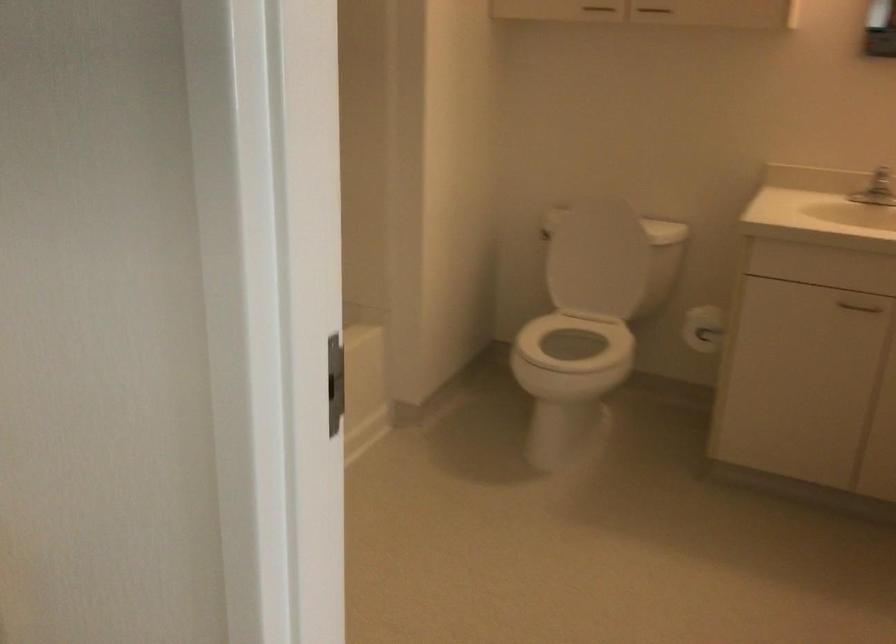
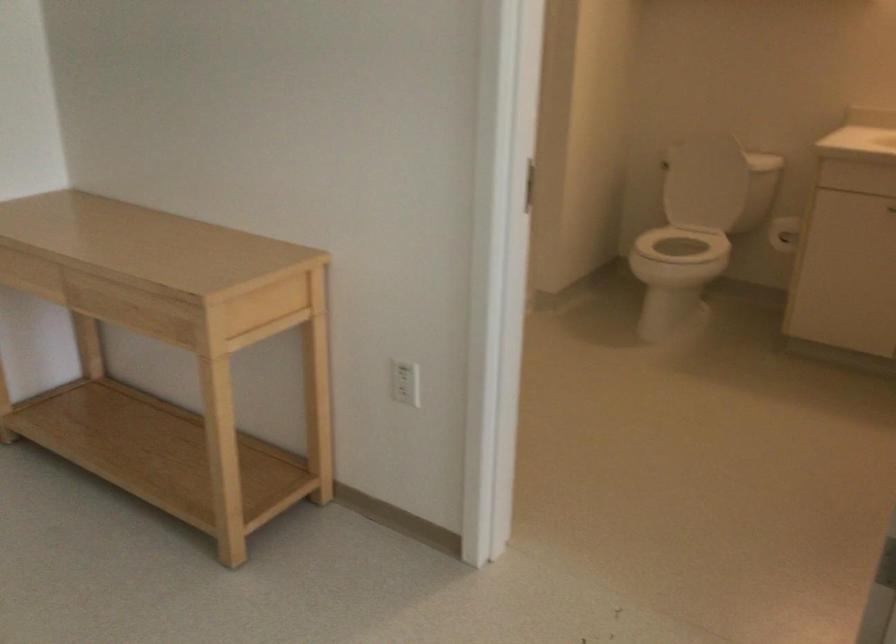
Question: How did the camera likely rotate?

Choices:
 (A) Left
 (B) Right
 (C) Up
 (D) Down

Answer: (A)